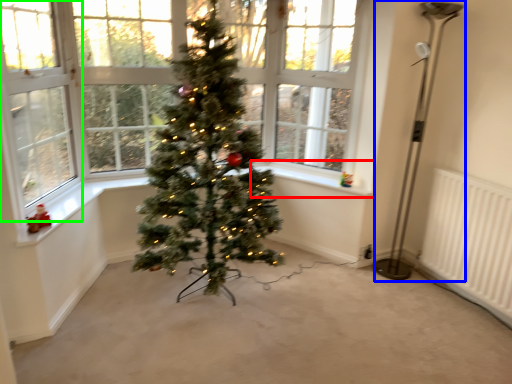
Question: Estimate the real-world distances between objects in this image. Which object is closer to window sill (highlighted by a red box), lamp (highlighted by a blue box) or window screen (highlighted by a green box)?

Choices:
 (A) lamp
 (B) window screen

Answer: (A)